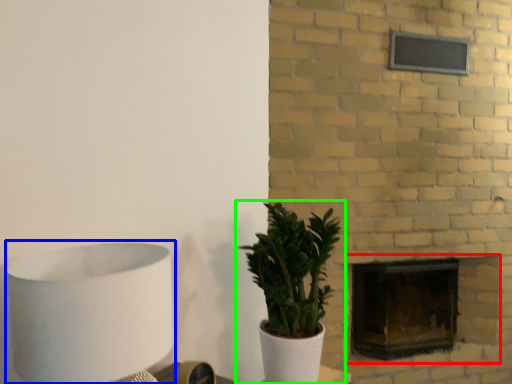
Question: Which object is the farthest from fireplace (highlighted by a red box)? Choose among these: table lamp (highlighted by a blue box) or houseplant (highlighted by a green box).

Choices:
 (A) table lamp
 (B) houseplant

Answer: (A)